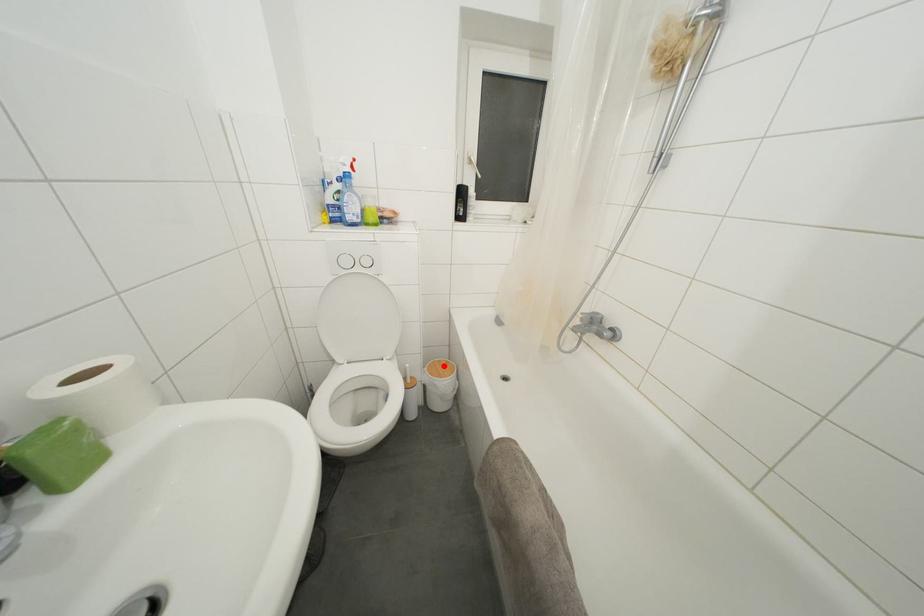
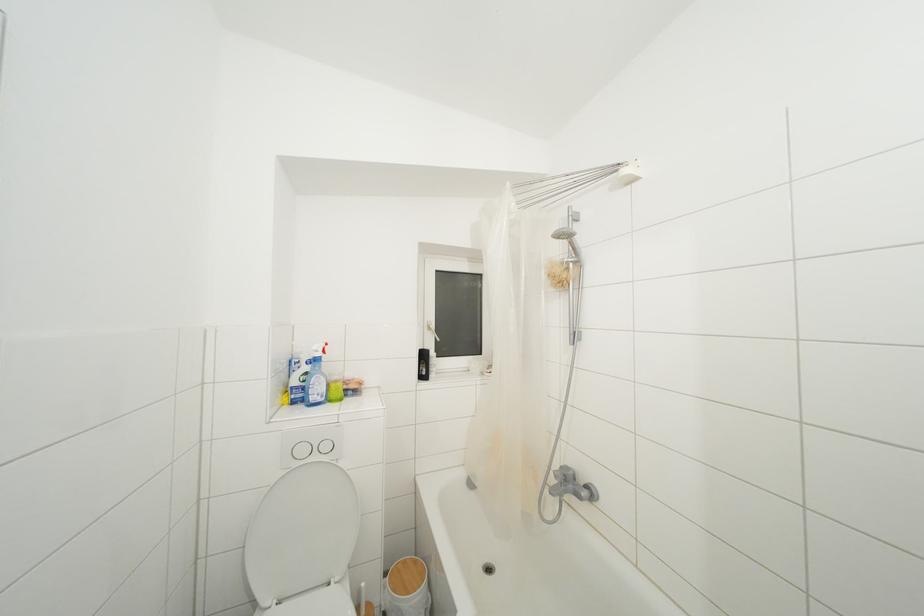
Question: I am providing you with two images of the same scene from different viewpoints. In image1, a red point is highlighted. Considering the same 3D point in image2, which of the following is correct?

Choices:
 (A) It is closer
 (B) It is farther

Answer: (B)